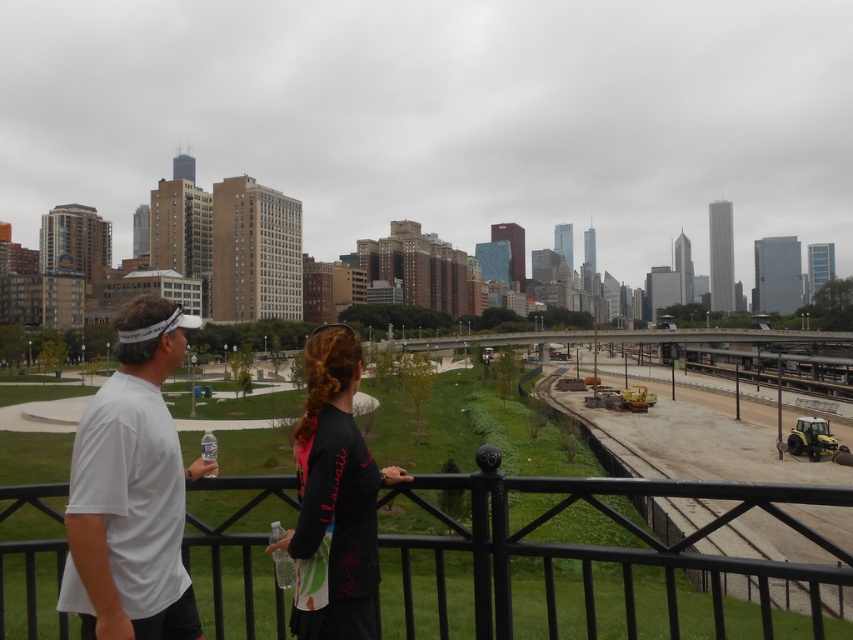
Between white matte shirt at center and white matte shirt at left, which one has less height?

With less height is white matte shirt at left.

Locate an element on the screen. The image size is (853, 640). white matte shirt at center is located at coordinates (132, 490).

Locate an element on the screen. The image size is (853, 640). white matte shirt at center is located at coordinates (132, 490).

Does point (80, 621) come in front of point (378, 488)?

No.

Between white matte shirt at left and black matte shirt at center, which one is positioned higher?

Positioned higher is white matte shirt at left.

In order to click on white matte shirt at left in this screenshot , I will do `click(131, 504)`.

What are the coordinates of `white matte shirt at left` in the screenshot? It's located at click(131, 504).

What do you see at coordinates (132, 490) in the screenshot? The width and height of the screenshot is (853, 640). I see `white matte shirt at center` at bounding box center [132, 490].

Who is taller, white matte shirt at center or black matte shirt at center?

Standing taller between the two is black matte shirt at center.

What do you see at coordinates (132, 490) in the screenshot? Image resolution: width=853 pixels, height=640 pixels. I see `white matte shirt at center` at bounding box center [132, 490].

Image resolution: width=853 pixels, height=640 pixels. Find the location of `white matte shirt at center`. white matte shirt at center is located at coordinates (132, 490).